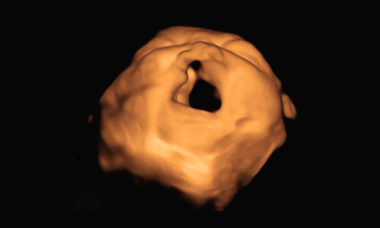
What are the coordinates of `corner` in the screenshot? It's located at (60, 52).